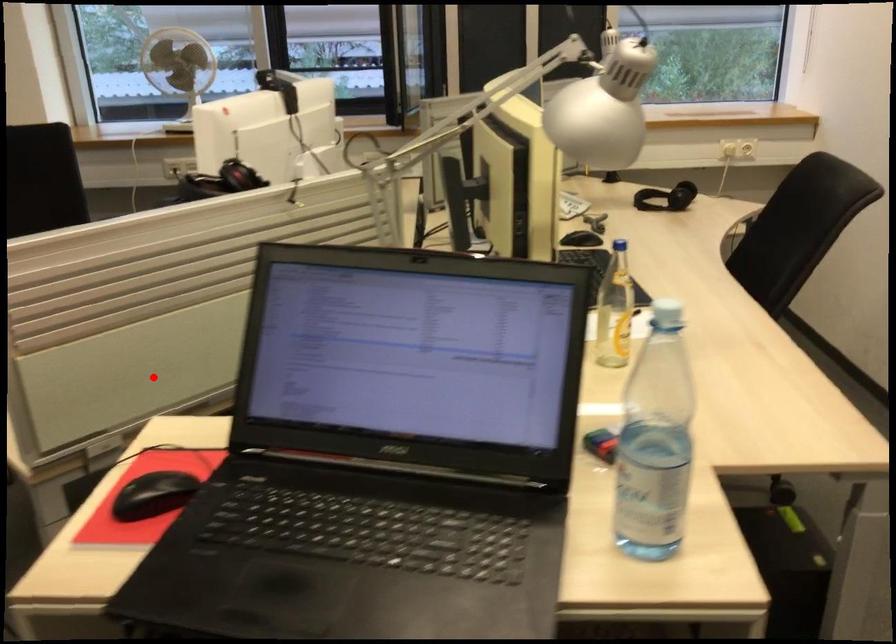
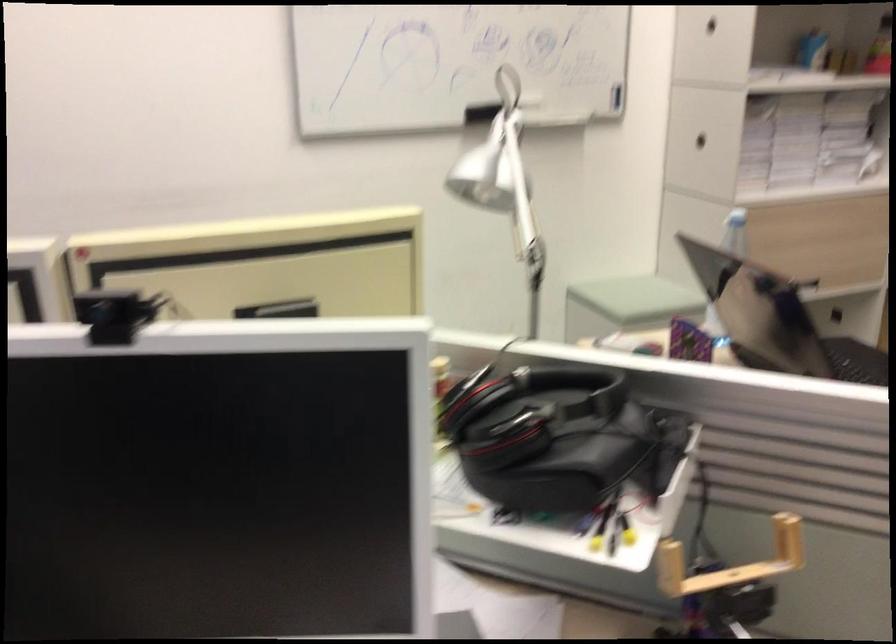
Question: I am providing you with two images of the same scene from different viewpoints. In image1, a red point is highlighted. Considering the same 3D point in image2, which of the following is correct?

Choices:
 (A) It is closer
 (B) It is farther

Answer: (A)